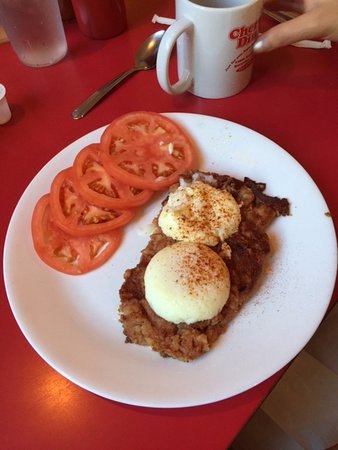
The width and height of the screenshot is (338, 450). In order to click on spoon in this screenshot , I will do `click(146, 52)`.